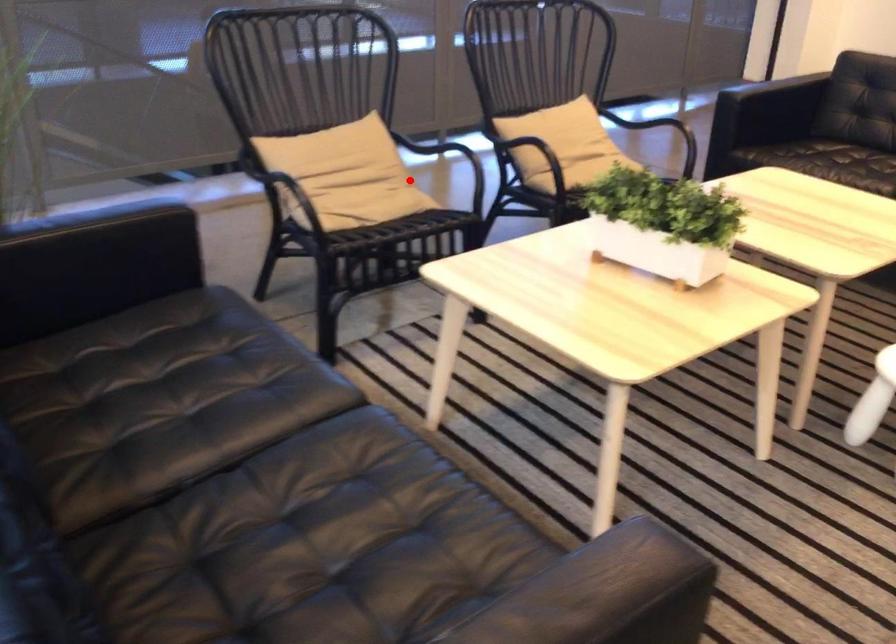
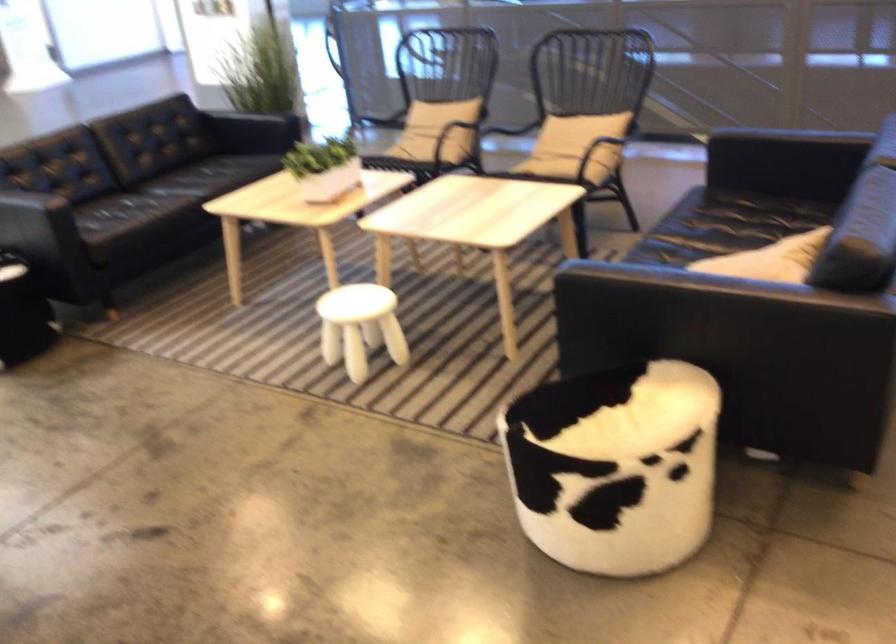
Question: I am providing you with two images of the same scene from different viewpoints. Image1 has a red point marked. In image2, the corresponding 3D location appears at what relative position? Reply with the corresponding letter.

Choices:
 (A) Closer
 (B) Farther

Answer: (B)